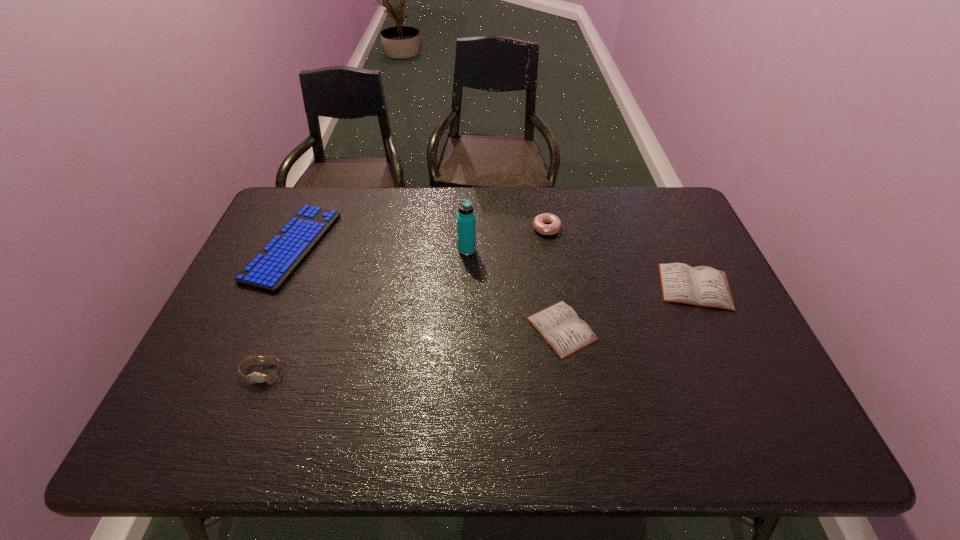
Identify which object is the third nearest to the computer keyboard. Please provide its 2D coordinates. Your answer should be formatted as a tuple, i.e. [(x, y)], where the tuple contains the x and y coordinates of a point satisfying the conditions above.

[(559, 325)]

At what (x,y) coordinates should I click in order to perform the action: click on free space in the image that satisfies the following two spatial constraints: 1. on the back side of the doughnut; 2. on the right side of the left diary. Please return your answer as a coordinate pair (x, y). The image size is (960, 540). Looking at the image, I should click on (545, 228).